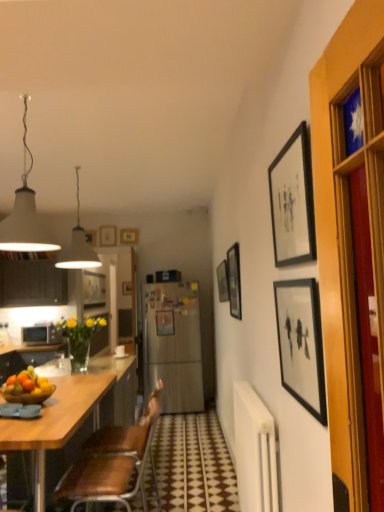
Question: Is point (21, 236) closer or farther from the camera than point (218, 287)?

Choices:
 (A) closer
 (B) farther

Answer: (A)

Question: Visually, is white matte lampshade at upper left, the second lamp viewed from the back, positioned to the left or to the right of matte black picture frame at upper center, which appears as the fourth picture frame when viewed from the back?

Choices:
 (A) left
 (B) right

Answer: (A)

Question: Which object is positioned farthest from the matte black picture frame at center, which appears as the 3th picture frame when viewed from the left?

Choices:
 (A) black matte picture frame at right, which is the seventh picture frame in left-to-right order
 (B) matte black cabinet at left
 (C) matte black picture frame at upper center, which appears as the 5th picture frame when viewed from the left
 (D) black matte picture frame at upper right, which appears as the sixth picture frame when viewed from the back
 (E) white matte lampshade at upper left, the second lamp viewed from the back

Answer: (D)

Question: Which of these objects is positioned closest to the white matte lampshade at upper left, arranged as the first lamp when viewed from the front?

Choices:
 (A) matte black picture frame at upper center, which appears as the fifth picture frame when viewed from the back
 (B) matte black cabinet at left
 (C) wooden picture frame at upper center, which is the 7th picture frame in right-to-left order
 (D) black matte picture frame at right, which ranks as the 1th picture frame in front-to-back order
 (E) matte black picture frame at center, which is counted as the third picture frame, starting from the back

Answer: (A)